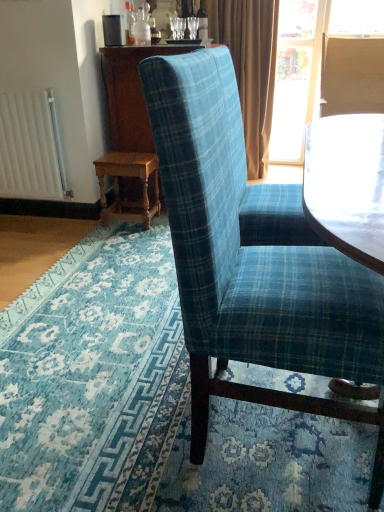
Where is `wooden chair back at upper right`? Image resolution: width=384 pixels, height=512 pixels. wooden chair back at upper right is located at coordinates (352, 75).

Describe the element at coordinates (119, 185) in the screenshot. I see `wooden table at lower left` at that location.

The image size is (384, 512). What do you see at coordinates (130, 95) in the screenshot?
I see `wooden dresser at center` at bounding box center [130, 95].

The width and height of the screenshot is (384, 512). What do you see at coordinates (253, 271) in the screenshot? I see `blue plaid fabric chair at center` at bounding box center [253, 271].

This screenshot has width=384, height=512. What do you see at coordinates (146, 403) in the screenshot?
I see `blue plaid fabric at center` at bounding box center [146, 403].

The image size is (384, 512). What are the coordinates of `wooden chair back at upper right` in the screenshot? It's located at (352, 75).

Is blue plaid fabric at center completely or partially inside wooden chair back at upper right?

That's incorrect, blue plaid fabric at center is not inside wooden chair back at upper right.

Can you confirm if wooden chair back at upper right is positioned to the right of blue plaid fabric at center?

Indeed, wooden chair back at upper right is positioned on the right side of blue plaid fabric at center.

Considering the relative sizes of wooden chair back at upper right and blue plaid fabric at center in the image provided, is wooden chair back at upper right thinner than blue plaid fabric at center?

Indeed, wooden chair back at upper right has a lesser width compared to blue plaid fabric at center.

In the scene shown: Is wooden chair back at upper right taller than blue plaid fabric at center?

Yes.

Is matte brown curtain at upper right wider or thinner than white matte radiator at left?

Considering their sizes, matte brown curtain at upper right looks broader than white matte radiator at left.

The height and width of the screenshot is (512, 384). What are the coordinates of `radiator on the left side of matte brown curtain at upper right` in the screenshot? It's located at (31, 147).

How far apart are matte brown curtain at upper right and white matte radiator at left?

matte brown curtain at upper right and white matte radiator at left are 5.18 feet apart.

Looking at this image, does matte brown curtain at upper right have a greater height compared to white matte radiator at left?

Yes.

Would you say wooden dresser at center is to the left or to the right of blue plaid fabric at center in the picture?

Based on their positions, wooden dresser at center is located to the left of blue plaid fabric at center.

What's the angular difference between wooden dresser at center and blue plaid fabric at center's facing directions?

0.66 degrees separate the facing orientations of wooden dresser at center and blue plaid fabric at center.

Is wooden dresser at center located outside blue plaid fabric at center?

Yes, wooden dresser at center is not within blue plaid fabric at center.

Looking at this image, is wooden dresser at center taller or shorter than blue plaid fabric at center?

wooden dresser at center is taller than blue plaid fabric at center.

Which is in front, blue plaid fabric at center or matte brown curtain at upper right?

blue plaid fabric at center is in front.

Is blue plaid fabric at center far away from matte brown curtain at upper right?

Yes, blue plaid fabric at center and matte brown curtain at upper right are located far from each other.

Considering the relative sizes of blue plaid fabric at center and matte brown curtain at upper right in the image provided, is blue plaid fabric at center bigger than matte brown curtain at upper right?

No, blue plaid fabric at center is not bigger than matte brown curtain at upper right.

Is blue plaid fabric chair at center looking in the opposite direction of white matte radiator at left?

No, blue plaid fabric chair at center is not facing away from white matte radiator at left.

Are blue plaid fabric chair at center and white matte radiator at left far apart?

blue plaid fabric chair at center is far away from white matte radiator at left.

Find the location of a particular element. The image size is (384, 512). chair located on the right of white matte radiator at left is located at coordinates (253, 271).

Is wooden chair back at upper right to the right of blue plaid fabric chair at center from the viewer's perspective?

Yes.

From a real-world perspective, between wooden chair back at upper right and blue plaid fabric chair at center, who is vertically lower?

blue plaid fabric chair at center is physically lower.

You are a GUI agent. You are given a task and a screenshot of the screen. Output one action in this format:
    pyautogui.click(x=<x>, y=<y>)
    Task: Click on the chair in front of the wooden chair back at upper right
    
    Given the screenshot: What is the action you would take?
    pyautogui.click(x=253, y=271)

Considering the relative sizes of matte brown curtain at upper right and blue plaid fabric chair at center in the image provided, is matte brown curtain at upper right bigger than blue plaid fabric chair at center?

No, matte brown curtain at upper right is not bigger than blue plaid fabric chair at center.

Is matte brown curtain at upper right facing away from blue plaid fabric chair at center?

No, matte brown curtain at upper right is not facing away from blue plaid fabric chair at center.

Consider the image. Considering the positions of objects matte brown curtain at upper right and blue plaid fabric chair at center in the image provided, who is more to the right, matte brown curtain at upper right or blue plaid fabric chair at center?

From the viewer's perspective, matte brown curtain at upper right appears more on the right side.

In the image, there is a blue plaid fabric at center. Where is `the back above it (from the image's perspective)`? the back above it (from the image's perspective) is located at coordinates (352, 75).

The height and width of the screenshot is (512, 384). I want to click on curtain that appears above the white matte radiator at left (from a real-world perspective), so click(250, 68).

Looking at the image, which one is located further to white matte radiator at left, wooden chair back at upper right or blue plaid fabric at center?

wooden chair back at upper right is further to white matte radiator at left.

From the image, which object appears to be nearer to blue plaid fabric at center, blue plaid fabric chair at center or wooden table at lower left?

blue plaid fabric chair at center.

Considering their positions, is wooden table at lower left positioned further to wooden chair back at upper right than blue plaid fabric chair at center?

Based on the image, blue plaid fabric chair at center appears to be further to wooden chair back at upper right.

Estimate the real-world distances between objects in this image. Which object is closer to matte brown curtain at upper right, wooden chair back at upper right or blue plaid fabric chair at center?

wooden chair back at upper right lies closer to matte brown curtain at upper right than the other object.

Based on their spatial positions, is wooden chair back at upper right or blue plaid fabric at center closer to matte brown curtain at upper right?

Based on the image, wooden chair back at upper right appears to be nearer to matte brown curtain at upper right.

Which object lies further to the anchor point wooden chair back at upper right, blue plaid fabric chair at center or white matte radiator at left?

Among the two, blue plaid fabric chair at center is located further to wooden chair back at upper right.

Based on their spatial positions, is blue plaid fabric chair at center or wooden dresser at center closer to matte brown curtain at upper right?

The object closer to matte brown curtain at upper right is wooden dresser at center.

Looking at this image, which object lies nearer to the anchor point matte brown curtain at upper right, blue plaid fabric at center or wooden table at lower left?

Based on the image, wooden table at lower left appears to be nearer to matte brown curtain at upper right.

Where is `radiator between blue plaid fabric at center and wooden dresser at center from front to back`? radiator between blue plaid fabric at center and wooden dresser at center from front to back is located at coordinates (31, 147).

The width and height of the screenshot is (384, 512). Identify the location of table located between blue plaid fabric chair at center and wooden chair back at upper right in the depth direction. (119, 185).

Where is `mat between blue plaid fabric chair at center and wooden dresser at center in the front-back direction`? Image resolution: width=384 pixels, height=512 pixels. mat between blue plaid fabric chair at center and wooden dresser at center in the front-back direction is located at coordinates (146, 403).

Locate an element on the screen. radiator between blue plaid fabric chair at center and wooden table at lower left in the front-back direction is located at coordinates (31, 147).